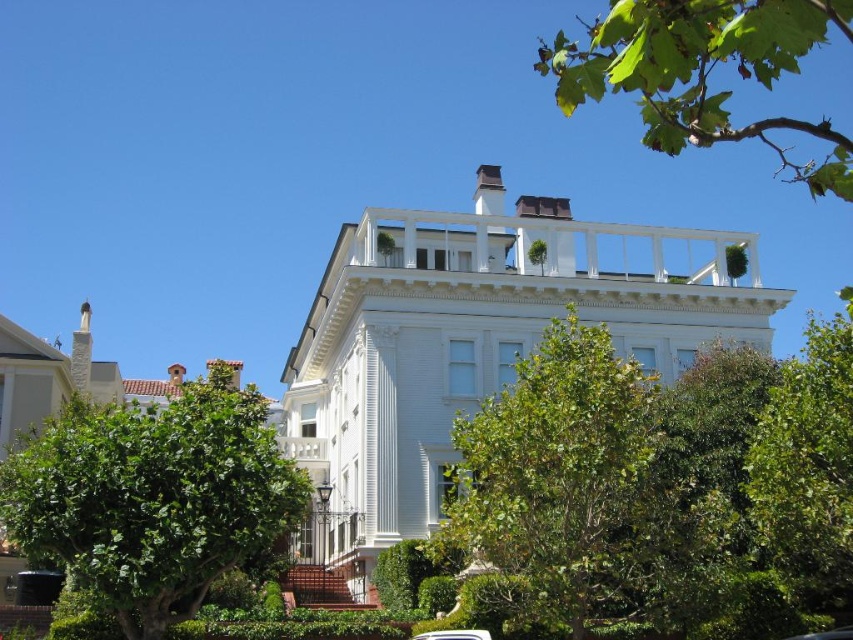
You are a photographer standing at the base of the hill where the grand Victorian house is located. You want to capture a photo of the house without any obstructions from the green leafy tree at lower left. Based on the distance provided, can you determine if you need to move closer to the house or further away to avoid the tree appearing in the frame?

The green leafy tree at lower left is 47.81 meters away from the camera. To avoid the tree appearing in the frame, you should move closer to the house, as the tree is currently within the camera range. Moving closer would reduce the field of view, potentially excluding the tree from the shot.

You are standing in front of the Victorian house and want to take a photo. You notice two points marked in the scene. Which point, point (413, 476) or point (486, 632), is closer to your camera lens?

Point (413, 476) is further to the camera than point (486, 632), so the point closer to your camera lens is point (486, 632).

You are a photographer planning to capture the white wood mansion at center and the white glossy car at center in a single shot. Based on their positions, which object should you position closer to the left side of your camera frame?

The white wood mansion at center should be positioned closer to the left side of the camera frame because it is located to the left of the white glossy car at center.